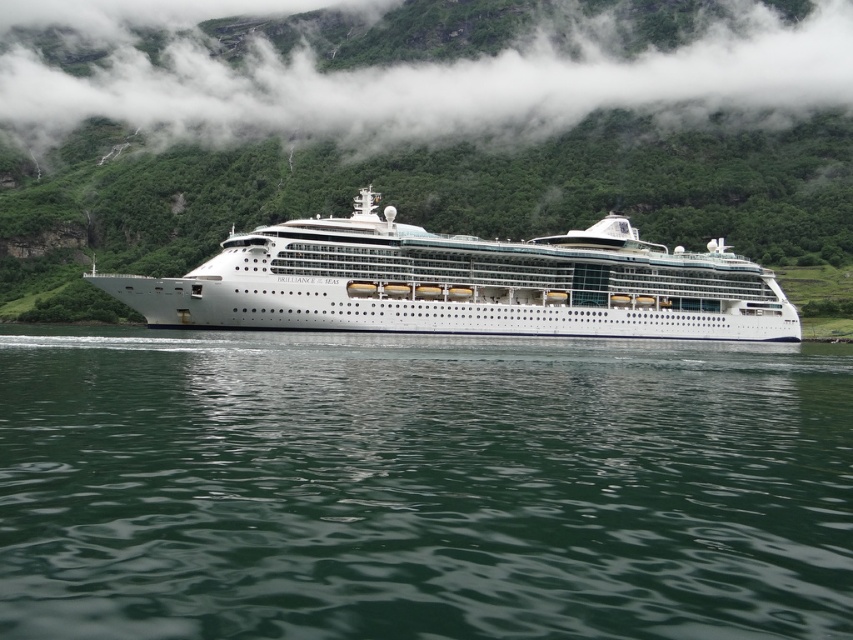
Question: Does white fluffy cloud at upper center lie in front of white glossy cruise ship at center?

Choices:
 (A) yes
 (B) no

Answer: (B)

Question: Is green liquid water at center to the left of white fluffy cloud at upper center from the viewer's perspective?

Choices:
 (A) yes
 (B) no

Answer: (B)

Question: Which object appears farthest from the camera in this image?

Choices:
 (A) white glossy cruise ship at center
 (B) white fluffy cloud at upper center
 (C) green liquid water at center

Answer: (B)

Question: Which object is positioned closest to the white glossy cruise ship at center?

Choices:
 (A) green liquid water at center
 (B) white fluffy cloud at upper center

Answer: (A)

Question: Which point is closer to the camera taking this photo?

Choices:
 (A) (82, 339)
 (B) (410, 324)

Answer: (A)

Question: Can you confirm if white fluffy cloud at upper center is positioned below white glossy cruise ship at center?

Choices:
 (A) yes
 (B) no

Answer: (B)